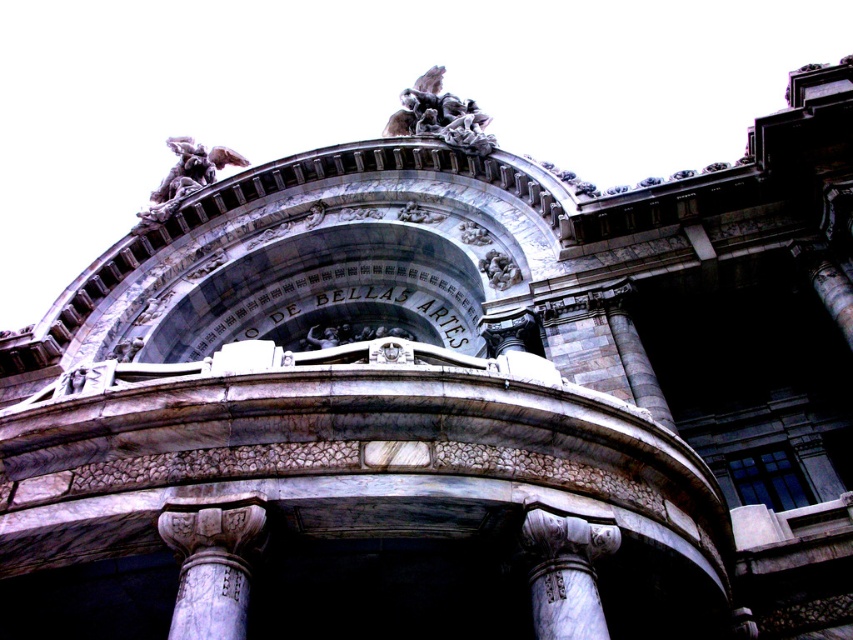
Question: Which point is closer to the camera?

Choices:
 (A) white marble column at center
 (B) silver metallic sculpture at upper center
 (C) polished stone sculpture at center

Answer: (A)

Question: Which object appears closest to the camera in this image?

Choices:
 (A) white marble column at center
 (B) silver metallic sculpture at upper center

Answer: (A)

Question: Observing the image, what is the correct spatial positioning of white marble column at lower center in reference to polished stone angel at upper center?

Choices:
 (A) below
 (B) above

Answer: (A)

Question: Does white marble column at lower center appear over silver metallic sculpture at upper center?

Choices:
 (A) no
 (B) yes

Answer: (A)

Question: Is polished stone angel at upper center wider than gray stone cherub at center?

Choices:
 (A) yes
 (B) no

Answer: (A)

Question: Which point appears farthest from the camera in this image?

Choices:
 (A) (483, 227)
 (B) (569, 628)

Answer: (A)